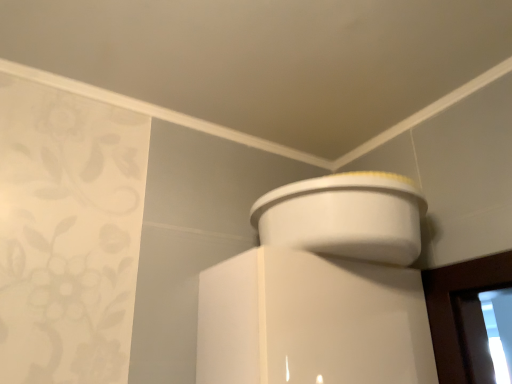
The image size is (512, 384). Identify the location of white glossy toilet at upper center. (345, 216).

What do you see at coordinates (345, 216) in the screenshot? I see `white glossy toilet at upper center` at bounding box center [345, 216].

What is the approximate height of white glossy toilet at upper center?

7.00 inches.

What are the coordinates of `white glossy toilet at upper center` in the screenshot? It's located at (345, 216).